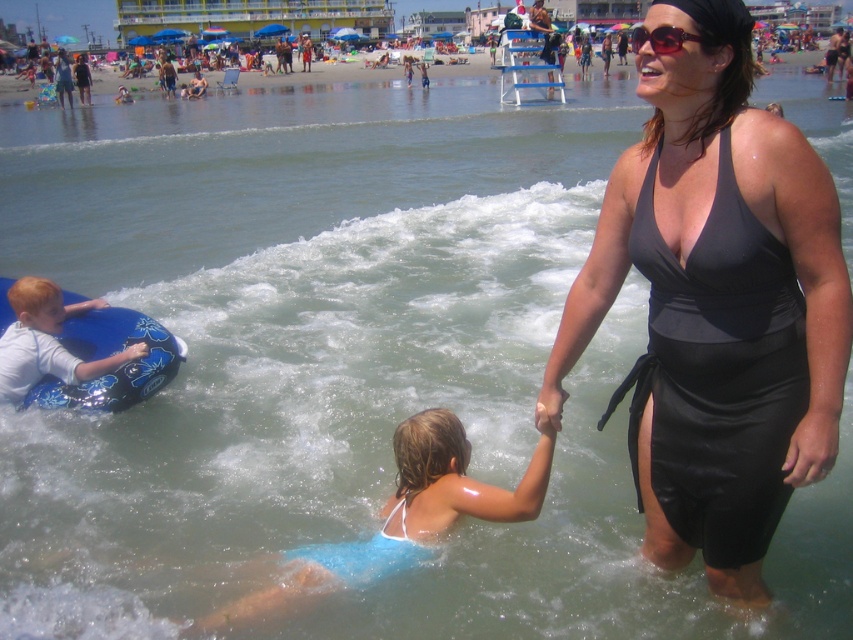
Does matte black swimsuit at center appear on the right side of light blue fabric swimsuit at lower center?

Correct, you'll find matte black swimsuit at center to the right of light blue fabric swimsuit at lower center.

Is point (688, 13) behind point (213, 620)?

No, (688, 13) is in front of (213, 620).

This screenshot has width=853, height=640. In order to click on matte black swimsuit at center in this screenshot , I will do (722, 228).

Looking at this image, is matte black swimsuit at center further to the viewer compared to blue rubber ring at left?

No, it is in front of blue rubber ring at left.

Where is `matte black swimsuit at center`? Image resolution: width=853 pixels, height=640 pixels. matte black swimsuit at center is located at coordinates (722, 228).

Between point (590, 308) and point (154, 323), which one is positioned behind?

The point (154, 323) is more distant.

This screenshot has height=640, width=853. Find the location of `matte black swimsuit at center`. matte black swimsuit at center is located at coordinates (722, 228).

Which of these two, light blue fabric swimsuit at lower center or blue rubber ring at left, stands taller?

With more height is light blue fabric swimsuit at lower center.

Is light blue fabric swimsuit at lower center behind blue rubber ring at left?

No, it is in front of blue rubber ring at left.

Between point (410, 490) and point (48, 339), which one is positioned in front?

Point (410, 490) is in front.

You are a GUI agent. You are given a task and a screenshot of the screen. Output one action in this format:
    pyautogui.click(x=<x>, y=<y>)
    Task: Click on the light blue fabric swimsuit at lower center
    
    Given the screenshot: What is the action you would take?
    pyautogui.click(x=405, y=515)